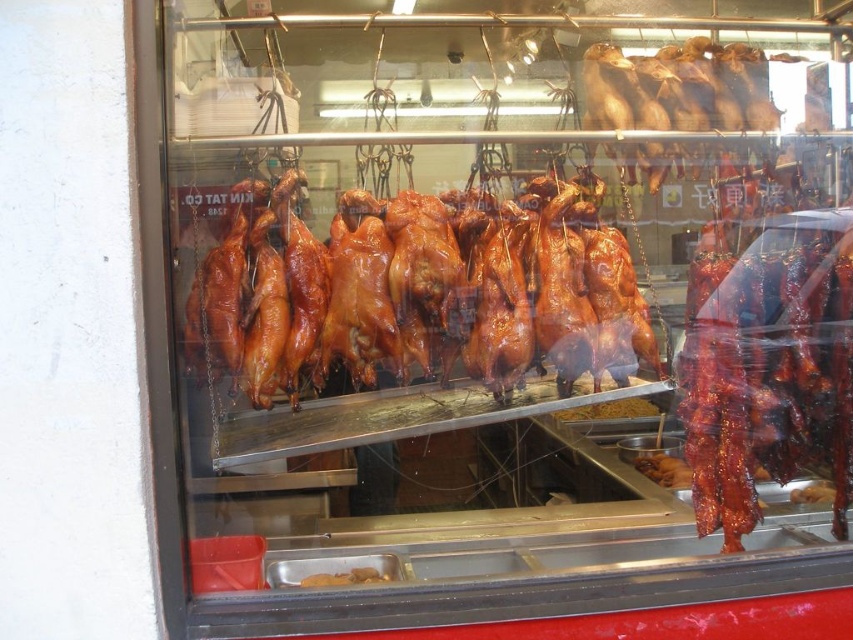
Question: Does brown glossy roasted duck at center come behind brown glossy meat at lower center?

Choices:
 (A) yes
 (B) no

Answer: (A)

Question: Which object is positioned closest to the brown glossy meat at lower center?

Choices:
 (A) brown glossy roasted duck at center
 (B) shiny brown meat at center
 (C) shiny brown duck at center

Answer: (C)

Question: Which point appears farthest from the camera in this image?

Choices:
 (A) (358, 566)
 (B) (709, 67)
 (C) (560, 376)

Answer: (A)

Question: Does shiny brown duck at center have a lesser width compared to brown glossy meat at lower center?

Choices:
 (A) yes
 (B) no

Answer: (B)

Question: Where is shiny brown meat at center located in relation to brown glossy roasted duck at center in the image?

Choices:
 (A) left
 (B) right

Answer: (B)

Question: Which object appears farthest from the camera in this image?

Choices:
 (A) shiny brown meat at center
 (B) brown glossy duck at center
 (C) shiny brown duck at center
 (D) brown glossy meat at lower center

Answer: (A)